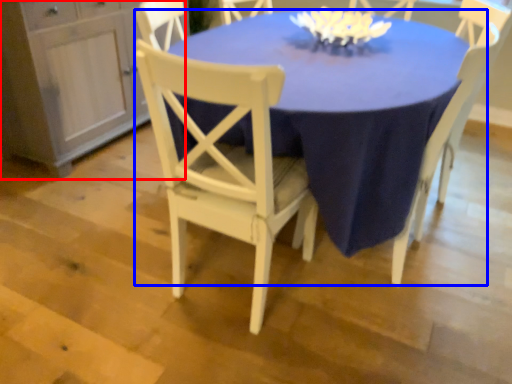
Question: Which point is further to the camera, dresser (highlighted by a red box) or table (highlighted by a blue box)?

Choices:
 (A) dresser
 (B) table

Answer: (A)